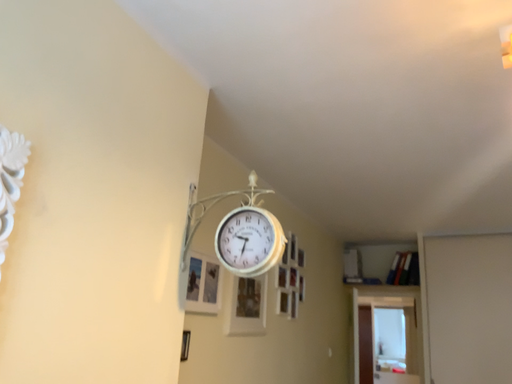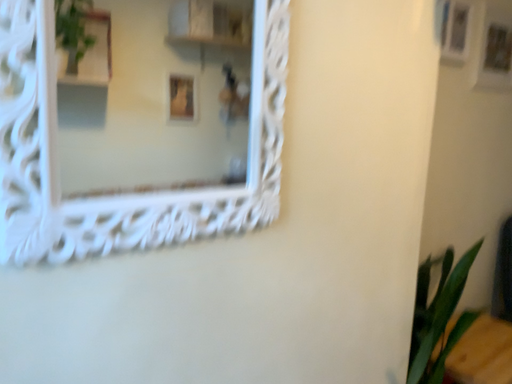
Question: How did the camera likely rotate when shooting the video?

Choices:
 (A) rotated right
 (B) rotated left

Answer: (B)